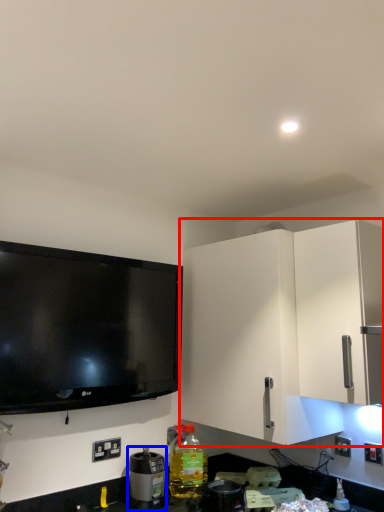
Question: Among these objects, which one is farthest to the camera, cabinetry (highlighted by a red box) or appliance (highlighted by a blue box)?

Choices:
 (A) cabinetry
 (B) appliance

Answer: (B)